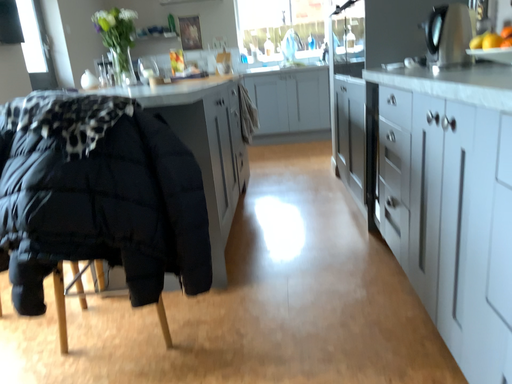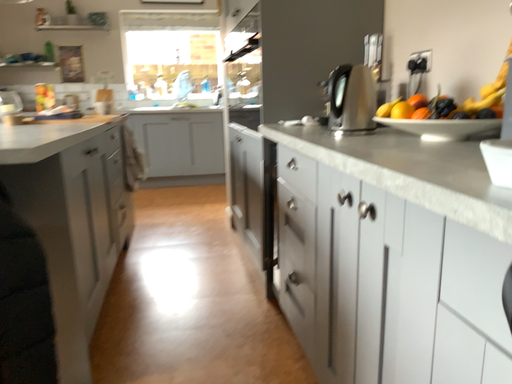
Question: How did the camera likely rotate when shooting the video?

Choices:
 (A) rotated right
 (B) rotated left

Answer: (A)